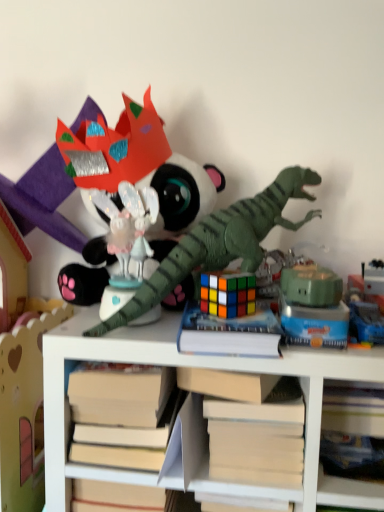
Question: Which is correct: hardcover book at center is inside shiny plastic dragon at center, which is the sixth toy in right-to-left order, or outside of it?

Choices:
 (A) inside
 (B) outside

Answer: (B)

Question: From the image's perspective, relative to shiny plastic dragon at center, placed as the 1th toy when sorted from left to right, is hardcover book at center above or below?

Choices:
 (A) above
 (B) below

Answer: (B)

Question: Estimate the real-world distances between objects in this image. Which object is closer to the green matte dinosaur at center, which is the second toy in right-to-left order?

Choices:
 (A) green matte dinosaur at center, the third toy in the left-to-right sequence
 (B) hardcover book at center
 (C) rubik's cube at center, which appears as the 5th toy when viewed from the right
 (D) metallic silver toy at center, arranged as the first toy when viewed from the right
 (E) white matte book at center

Answer: (B)

Question: Which object is positioned closest to the green matte robot at center, arranged as the 3th toy when viewed from the right?

Choices:
 (A) hardcover book at center
 (B) green matte dinosaur at center, which is the second toy in right-to-left order
 (C) white matte book at center
 (D) green matte dinosaur at center, the third toy in the left-to-right sequence
 (E) rubik's cube at center, the 2th toy viewed from the left

Answer: (B)